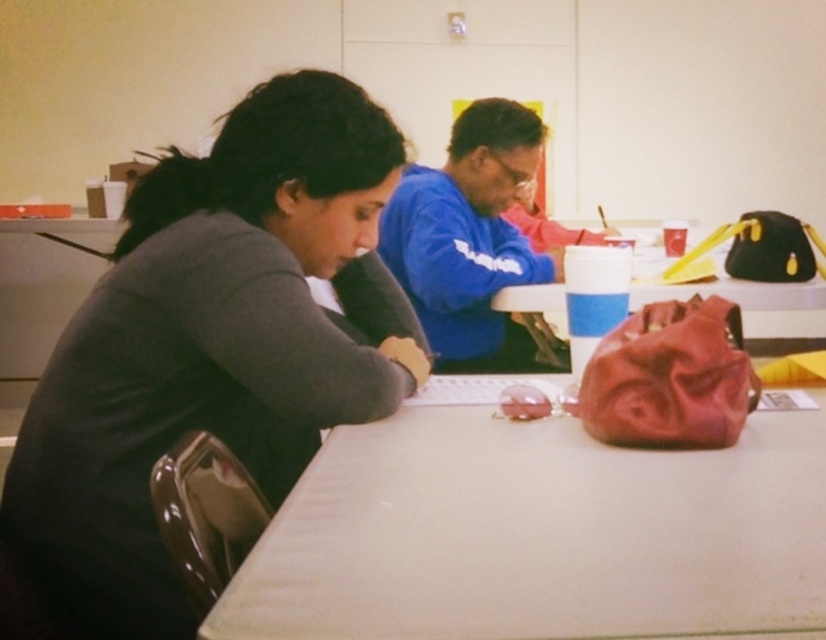
You are a delivery person who needs to leave a package on the table. The table has a dark gray sweater at center. Where should you place the package so it doesn not cover the sweater?

Place the package away from the center of the table, specifically avoiding the area at point coordinates (212, 346) where the dark gray sweater at center is located.

You are planning to place a large textbook on the table. Based on the scene, can the white matte table at center accommodate the rubberized red bag at center and the textbook without overlapping?

The white matte table at center might be wider than the rubberized red bag at center, so there could be enough space to place the textbook alongside the bag without overlapping.